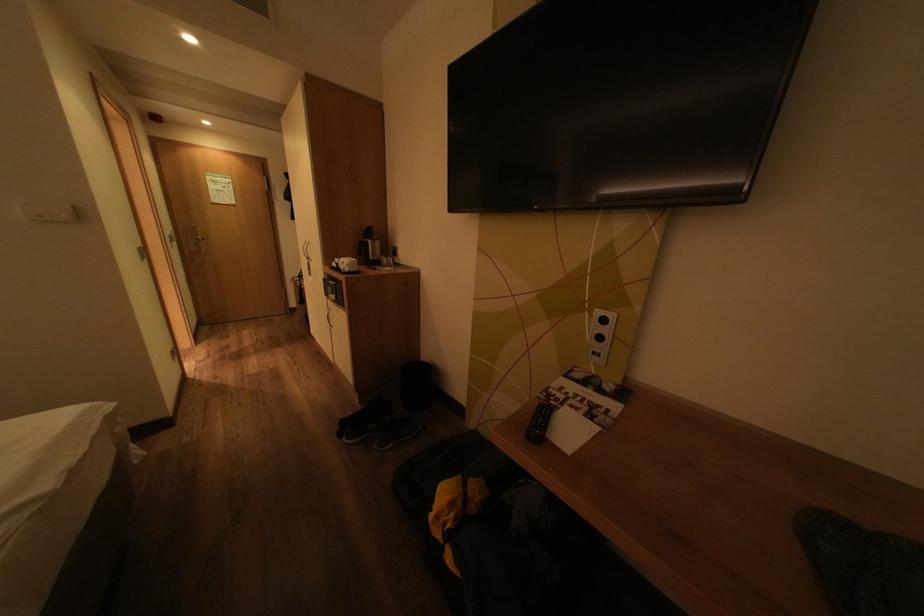
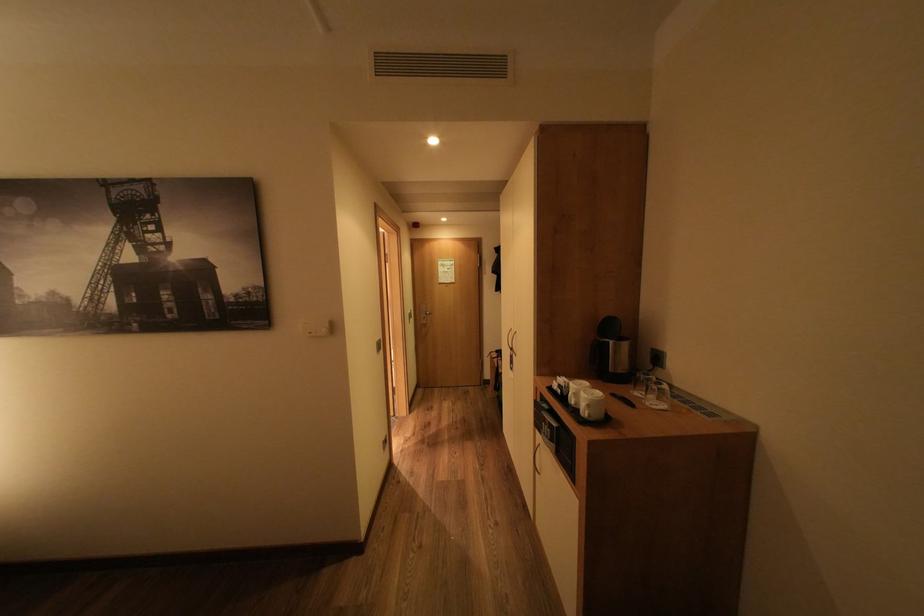
Where in the second image is the point corresponding to point 358,265 from the first image?

(600, 406)